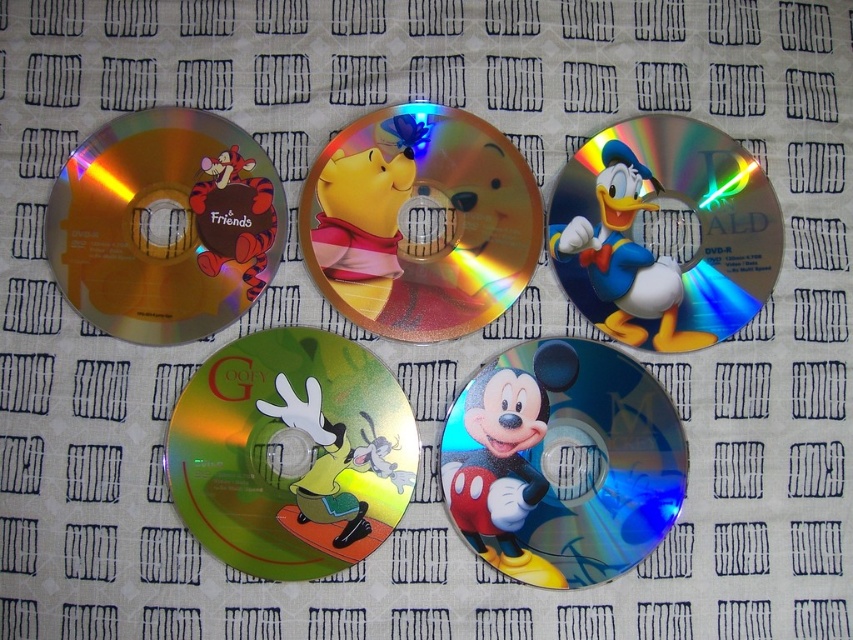
Can you confirm if glossy plastic mickey mouse at center is positioned to the left of gold reflective dvd at upper left?

Incorrect, glossy plastic mickey mouse at center is not on the left side of gold reflective dvd at upper left.

Can you confirm if glossy plastic mickey mouse at center is positioned below gold reflective dvd at upper left?

Correct, glossy plastic mickey mouse at center is located below gold reflective dvd at upper left.

Which is in front, point (563, 365) or point (144, 273)?

Point (144, 273) is more forward.

The image size is (853, 640). What are the coordinates of `glossy plastic mickey mouse at center` in the screenshot? It's located at (561, 461).

Between gold reflective dvd at upper left and shiny gold donald duck at upper right, which one is positioned lower?

shiny gold donald duck at upper right is below.

Is point (244, 209) less distant than point (666, 298)?

Yes, point (244, 209) is in front of point (666, 298).

Where is `gold reflective dvd at upper left`? gold reflective dvd at upper left is located at coordinates (165, 225).

Does glossy winnie the pooh at center have a smaller size compared to gold reflective dvd at upper left?

Indeed, glossy winnie the pooh at center has a smaller size compared to gold reflective dvd at upper left.

Is point (416, 145) farther from camera compared to point (190, 305)?

That is True.

In order to click on glossy winnie the pooh at center in this screenshot , I will do `click(421, 221)`.